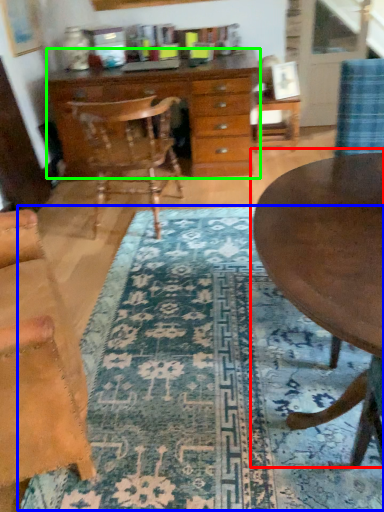
Question: Estimate the real-world distances between objects in this image. Which object is closer to coffee table (highlighted by a red box), mat (highlighted by a blue box) or chest of drawers (highlighted by a green box)?

Choices:
 (A) mat
 (B) chest of drawers

Answer: (A)